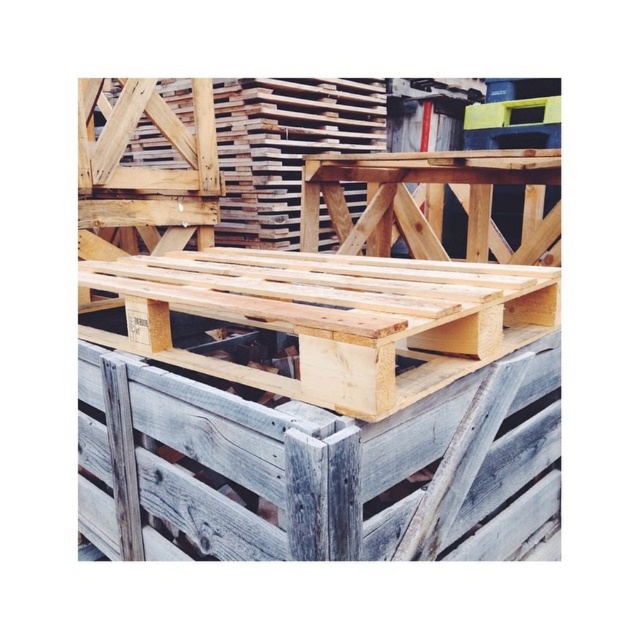
Who is lower down, natural light wood pallet at center or weathered gray wood at center?

weathered gray wood at center is below.

Which is more to the left, natural light wood pallet at center or weathered gray wood at center?

natural light wood pallet at center is more to the left.

You are a GUI agent. You are given a task and a screenshot of the screen. Output one action in this format:
    pyautogui.click(x=<x>, y=<y>)
    Task: Click on the natural light wood pallet at center
    The width and height of the screenshot is (640, 640).
    Given the screenshot: What is the action you would take?
    pos(324,388)

Where is `natural light wood pallet at center`? The width and height of the screenshot is (640, 640). natural light wood pallet at center is located at coordinates pyautogui.click(x=324, y=388).